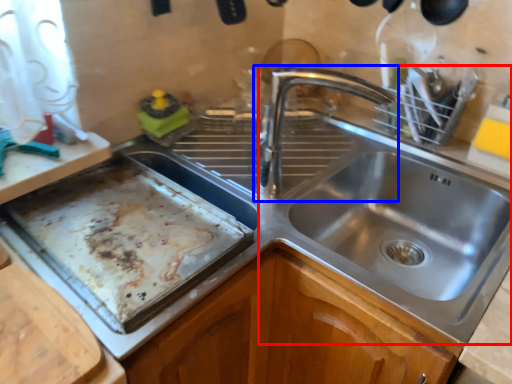
Question: Which object appears closest to the camera in this image, sink (highlighted by a red box) or tap (highlighted by a blue box)?

Choices:
 (A) sink
 (B) tap

Answer: (A)